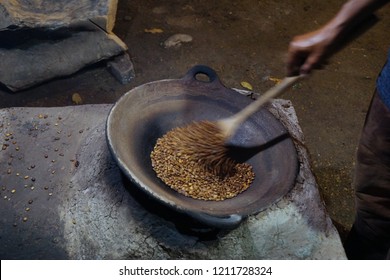
Locate an element on the screen. stone table is located at coordinates (93, 215).